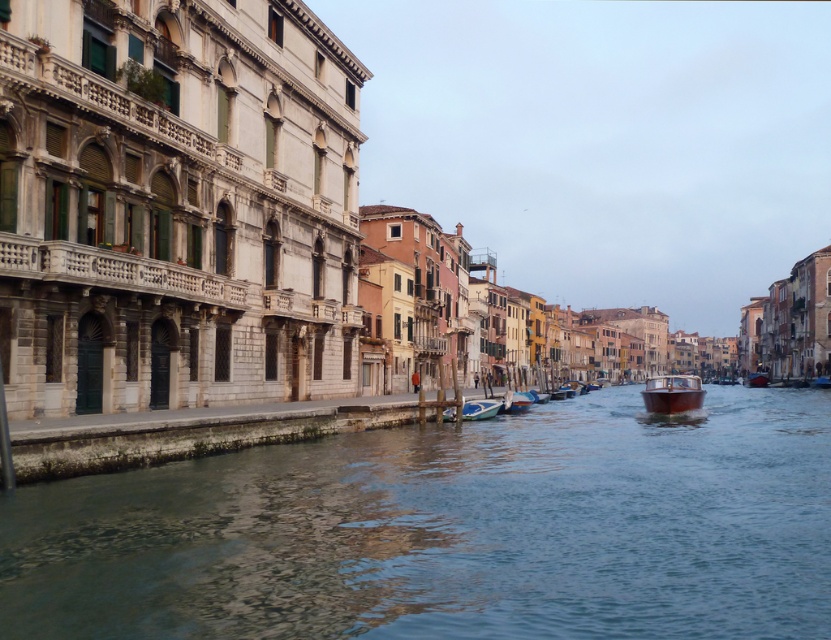
Does wooden boat at center have a greater height compared to metallic blue boat at center?

Yes, wooden boat at center is taller than metallic blue boat at center.

Locate an element on the screen. wooden boat at center is located at coordinates (672, 394).

What are the coordinates of `wooden boat at center` in the screenshot? It's located at (672, 394).

Is point (522, 392) positioned in front of point (748, 376)?

Yes.

Between metallic blue boat at center and shiny red boat at center, which one has less height?

metallic blue boat at center

Which is in front, point (522, 401) or point (766, 380)?

Point (522, 401)

This screenshot has height=640, width=831. Find the location of `metallic blue boat at center`. metallic blue boat at center is located at coordinates (519, 403).

Does clear water at center appear over wooden boat at center?

Yes, clear water at center is above wooden boat at center.

Between clear water at center and wooden boat at center, which one has more height?

wooden boat at center

The width and height of the screenshot is (831, 640). Find the location of `clear water at center`. clear water at center is located at coordinates (450, 531).